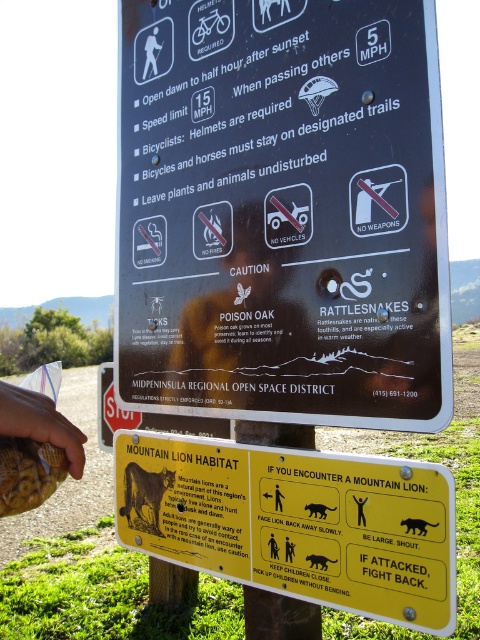
Does point (416, 529) come in front of point (358, 499)?

Yes, it is.

Between black matte cat at lower right and black matte human at upper center, which one has less height?

black matte cat at lower right is shorter.

Which is in front, point (414, 524) or point (354, 497)?

Point (414, 524) is more forward.

Find the location of a particular element. This screenshot has height=640, width=480. black matte cat at lower right is located at coordinates (417, 525).

Can you confirm if black matte cat at center is positioned to the left of black fur mountain lion at lower center?

Yes, black matte cat at center is to the left of black fur mountain lion at lower center.

Where is `black matte cat at center`? This screenshot has width=480, height=640. black matte cat at center is located at coordinates (317, 509).

The width and height of the screenshot is (480, 640). I want to click on black matte cat at center, so click(x=317, y=509).

Is brown textured bag at lower left further to camera compared to black fur mountain lion at lower center?

No.

Is brown textured bag at lower left to the left of black fur mountain lion at lower center from the viewer's perspective?

Yes, brown textured bag at lower left is to the left of black fur mountain lion at lower center.

The height and width of the screenshot is (640, 480). What are the coordinates of `brown textured bag at lower left` in the screenshot? It's located at (34, 449).